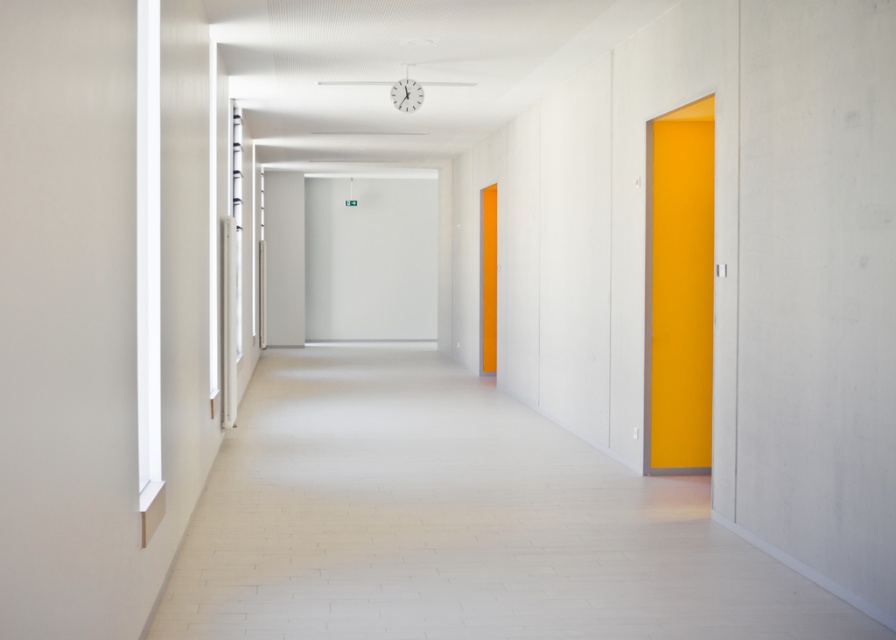
Between point (656, 148) and point (495, 358), which one is positioned behind?

The point (495, 358) is behind.

Which of these two, yellow matte door at right or orange matte door at center, stands taller?

With more height is orange matte door at center.

Identify the location of yellow matte door at right. (679, 291).